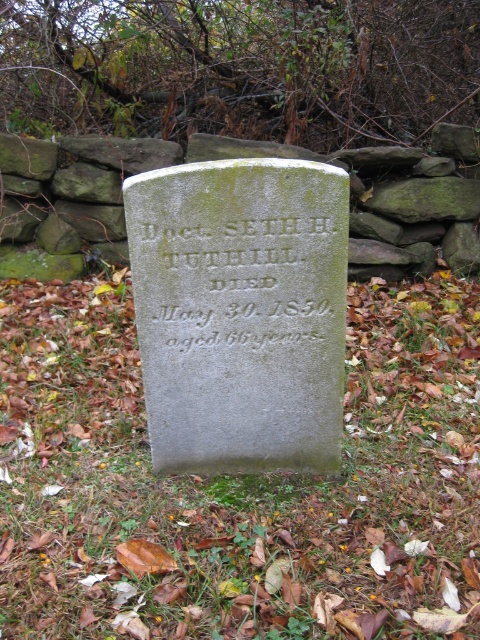
Question: Can you confirm if green mossy stone at center is positioned above green stone inscription at center?

Choices:
 (A) yes
 (B) no

Answer: (B)

Question: Can you confirm if green mossy stone at center is positioned to the left of green stone inscription at center?

Choices:
 (A) yes
 (B) no

Answer: (A)

Question: Does green mossy stone at center have a larger size compared to green stone inscription at center?

Choices:
 (A) no
 (B) yes

Answer: (B)

Question: Which object appears closest to the camera in this image?

Choices:
 (A) green mossy stone at center
 (B) green stone inscription at center

Answer: (A)